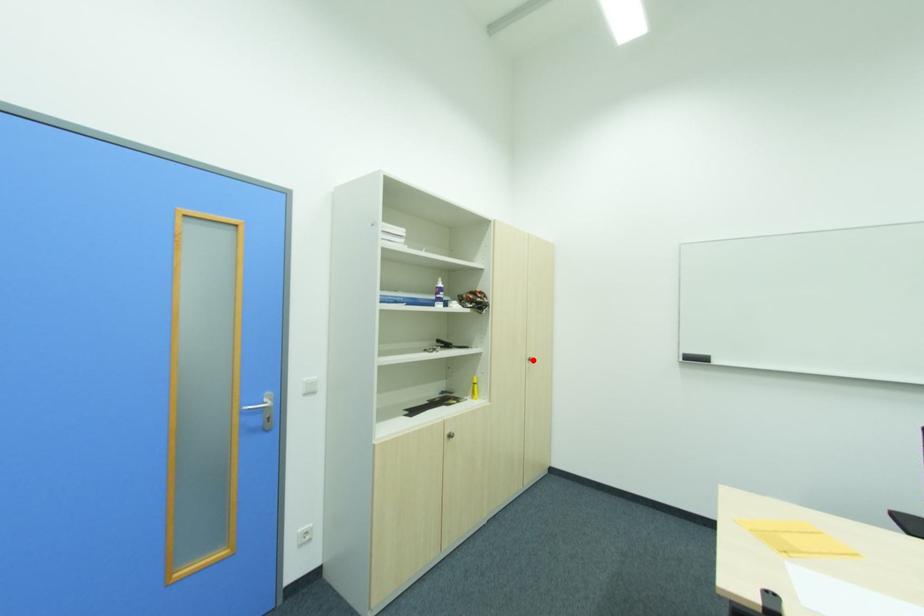
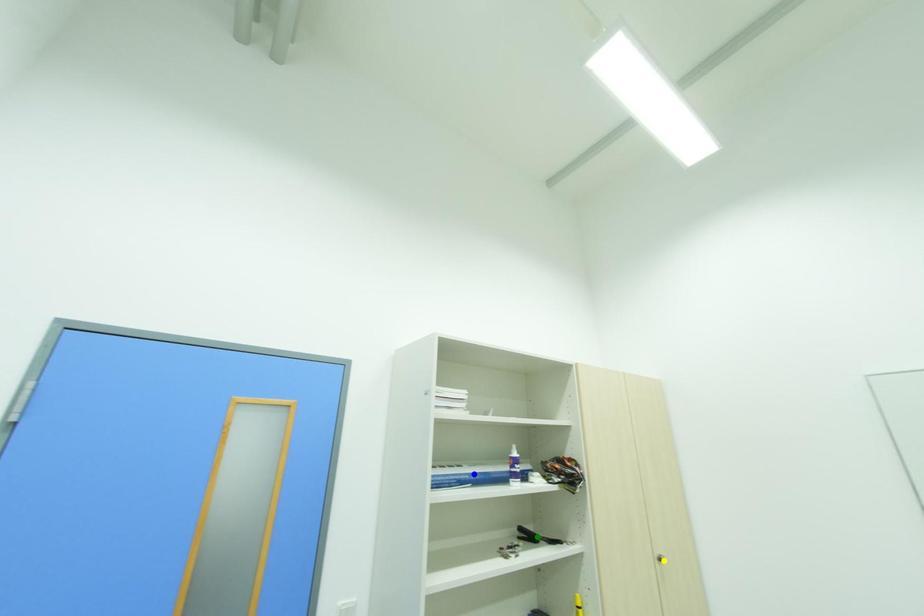
Question: I am providing you with two images of the same scene from different viewpoints. A red point is marked on the first image. You are given multiple points on the second image. Which spot in image 2 lines up with the point in image 1?

Choices:
 (A) green point
 (B) yellow point
 (C) blue point

Answer: (B)